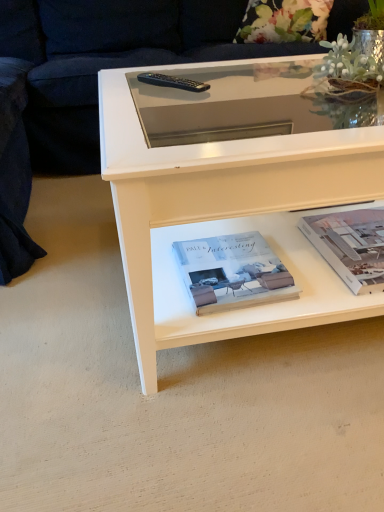
Find the location of a particular element. The height and width of the screenshot is (512, 384). free spot above white matte book at center, the 2th paperback book viewed from the right (from a real-world perspective) is located at coordinates (230, 271).